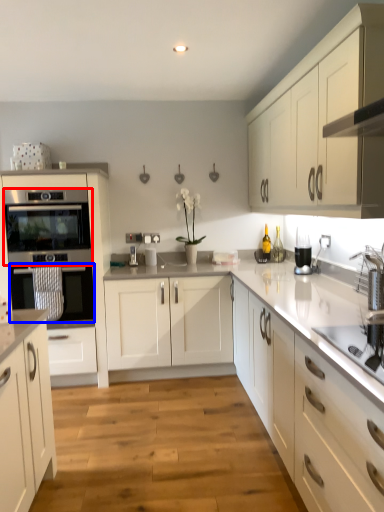
Question: Among these objects, which one is nearest to the camera, oven (highlighted by a red box) or oven (highlighted by a blue box)?

Choices:
 (A) oven
 (B) oven

Answer: (A)